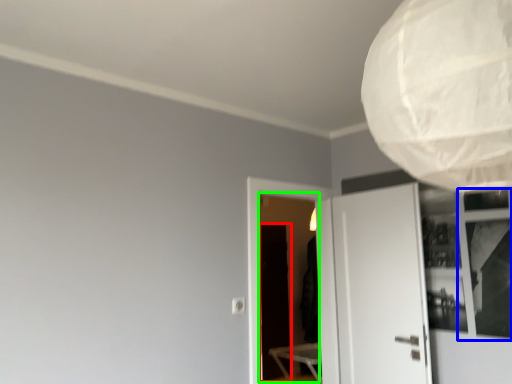
Question: Considering the real-world distances, which object is farthest from screen door (highlighted by a red box)? window (highlighted by a blue box) or screen door (highlighted by a green box)?

Choices:
 (A) window
 (B) screen door

Answer: (A)